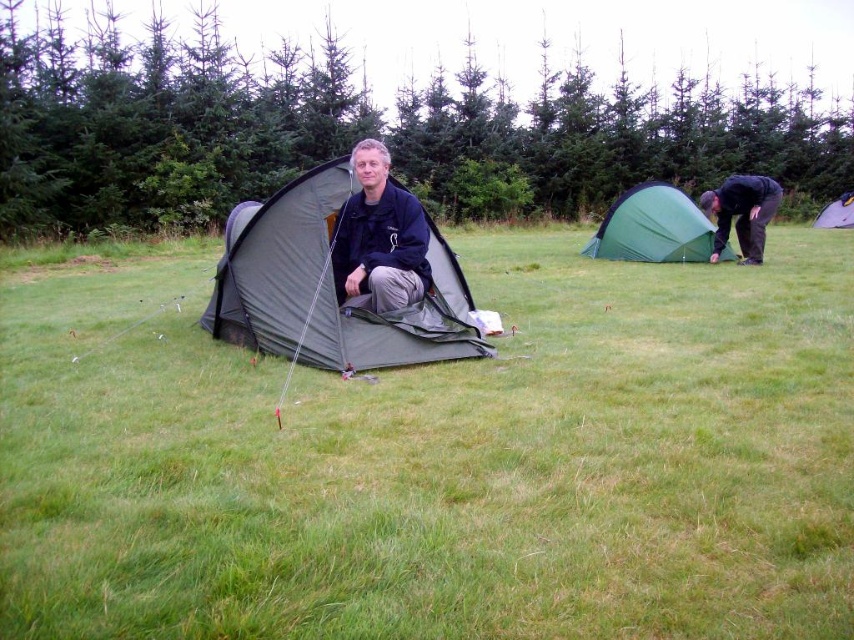
Identify the location of green fabric tent at center. The height and width of the screenshot is (640, 854). (329, 285).

What are the coordinates of `green fabric tent at center` in the screenshot? It's located at (329, 285).

Who is positioned more to the left, green grass at center or green fabric tent at right?

From the viewer's perspective, green grass at center appears more on the left side.

Can you confirm if green grass at center is bigger than green fabric tent at right?

Actually, green grass at center might be smaller than green fabric tent at right.

Who is more distant from viewer, (575,296) or (609,244)?

The point (609,244) is behind.

At what (x,y) coordinates should I click in order to perform the action: click on green grass at center. Please return your answer as a coordinate pair (x, y). The height and width of the screenshot is (640, 854). Looking at the image, I should click on (442, 461).

Between point (28, 353) and point (475, 342), which one is positioned in front?

Positioned in front is point (475, 342).

Is green grass at center bigger than green fabric tent at center?

No, green grass at center is not bigger than green fabric tent at center.

Is point (127, 420) farther from viewer compared to point (348, 336)?

No, (127, 420) is in front of (348, 336).

At what (x,y) coordinates should I click in order to perform the action: click on green grass at center. Please return your answer as a coordinate pair (x, y). The height and width of the screenshot is (640, 854). Looking at the image, I should click on (442, 461).